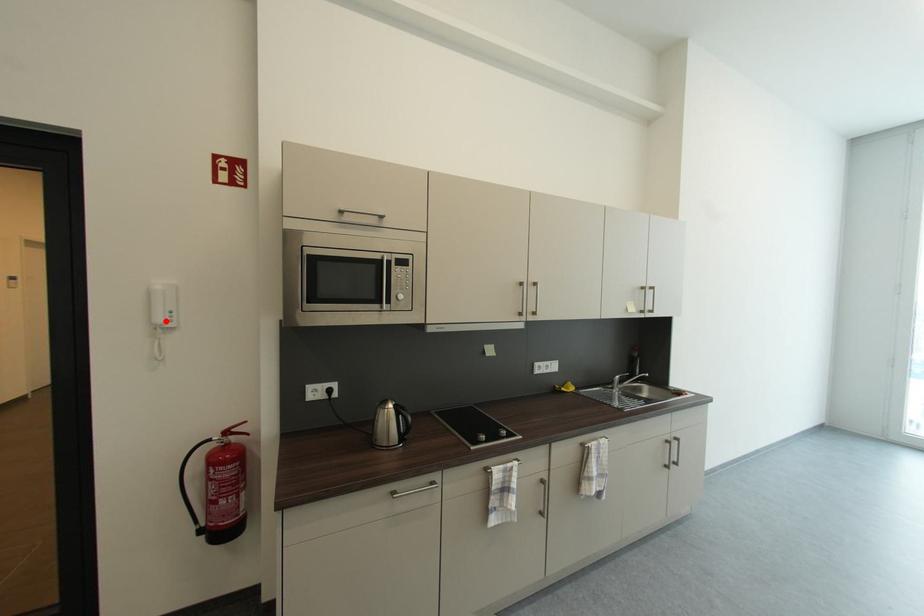
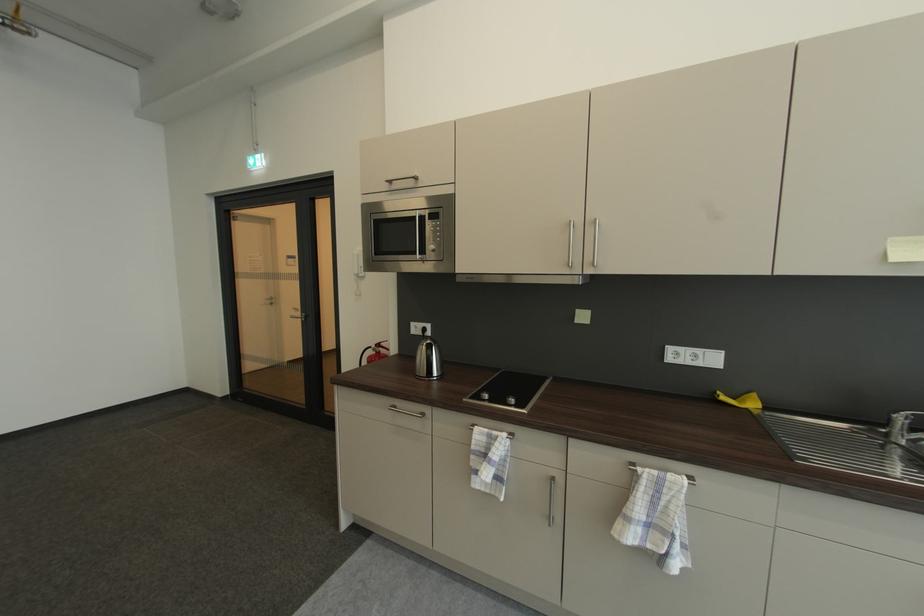
Find the pixel in the second image that matches the highlighted location in the first image.

(362, 273)